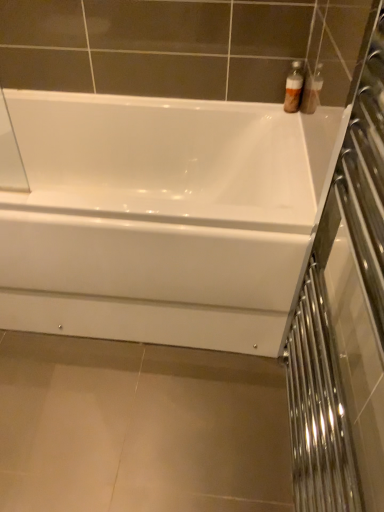
Question: From the image's perspective, relative to white glossy bathtub at center, is translucent plastic bottles at upper right above or below?

Choices:
 (A) below
 (B) above

Answer: (B)

Question: From a real-world perspective, is translucent plastic bottles at upper right above or below white glossy bathtub at center?

Choices:
 (A) below
 (B) above

Answer: (B)

Question: Which object is the farthest from the clear glass screen door at right?

Choices:
 (A) white glossy bathtub at center
 (B) translucent plastic bottles at upper right

Answer: (B)

Question: Which object is positioned closest to the white glossy bathtub at center?

Choices:
 (A) clear glass screen door at right
 (B) translucent plastic bottles at upper right

Answer: (A)